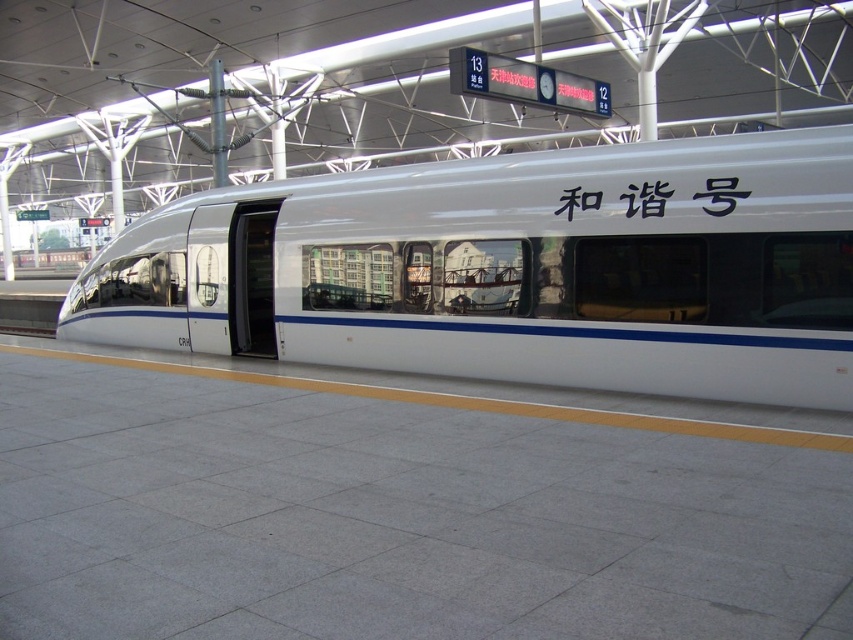
Question: Does white glossy train at center have a greater width compared to white matte text at center?

Choices:
 (A) no
 (B) yes

Answer: (B)

Question: Is gray concrete platform at center positioned in front of white matte text at center?

Choices:
 (A) no
 (B) yes

Answer: (B)

Question: Which object is the closest to the white glossy train at center?

Choices:
 (A) white matte text at center
 (B) gray concrete platform at center

Answer: (B)

Question: Which point is closer to the camera?

Choices:
 (A) gray concrete platform at center
 (B) white matte text at center
 (C) white glossy train at center

Answer: (A)

Question: Which of the following is the closest to the observer?

Choices:
 (A) (741, 189)
 (B) (573, 348)

Answer: (A)

Question: Can you confirm if gray concrete platform at center is positioned above white matte text at center?

Choices:
 (A) yes
 (B) no

Answer: (B)